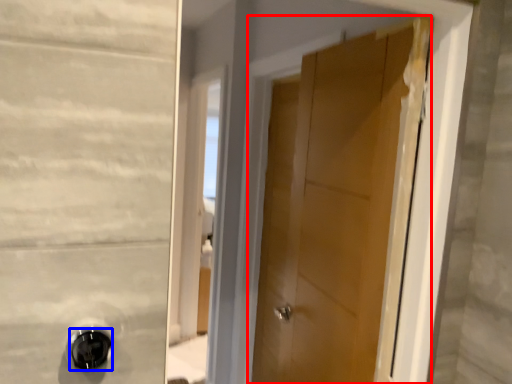
Question: Which point is closer to the camera, door (highlighted by a red box) or door handle (highlighted by a blue box)?

Choices:
 (A) door
 (B) door handle

Answer: (B)